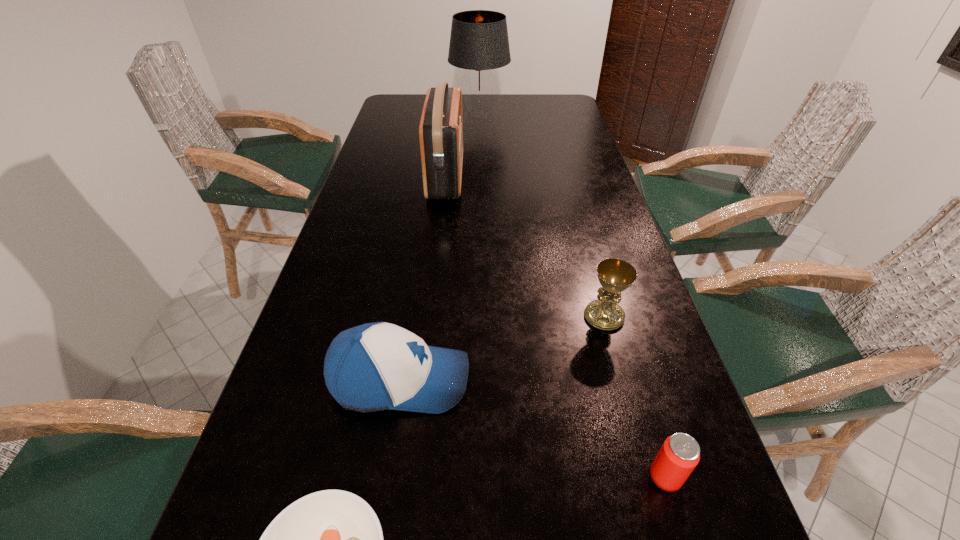
Find the location of `free location located on the front-facing side of the fourth farthest object`. free location located on the front-facing side of the fourth farthest object is located at coordinates (576, 380).

Locate an element on the screen. The width and height of the screenshot is (960, 540). vacant space located on the back of the third farthest object is located at coordinates (593, 277).

I want to click on free point located on the back of the fifth farthest object, so point(636,378).

The width and height of the screenshot is (960, 540). Identify the location of object situated at the far edge. click(479, 44).

At what (x,y) coordinates should I click in order to perform the action: click on object located in the left edge section of the desktop. Please return your answer as a coordinate pair (x, y). This screenshot has width=960, height=540. Looking at the image, I should click on (377, 366).

Identify the location of chalice that is positioned at the right edge. This screenshot has height=540, width=960. (615, 275).

At what (x,y) coordinates should I click in order to perform the action: click on beer can present at the right edge. Please return your answer as a coordinate pair (x, y). This screenshot has width=960, height=540. Looking at the image, I should click on (679, 455).

The width and height of the screenshot is (960, 540). I want to click on vacant space at the far edge of the desktop, so coord(510,104).

In order to click on vacant space at the left edge of the desktop in this screenshot , I will do `click(320, 383)`.

This screenshot has height=540, width=960. In the image, there is a desktop. Find the location of `vacant space at the right edge`. vacant space at the right edge is located at coordinates (637, 386).